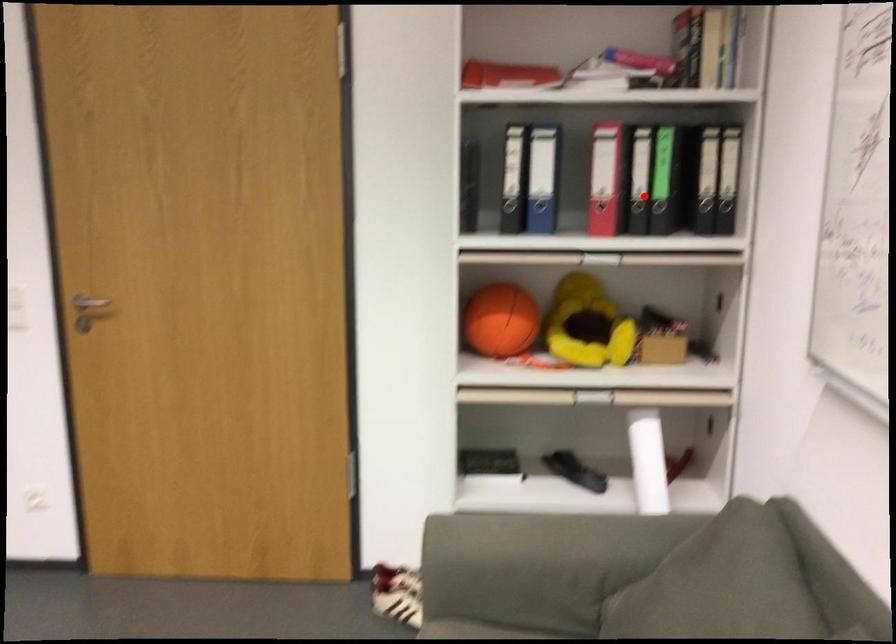
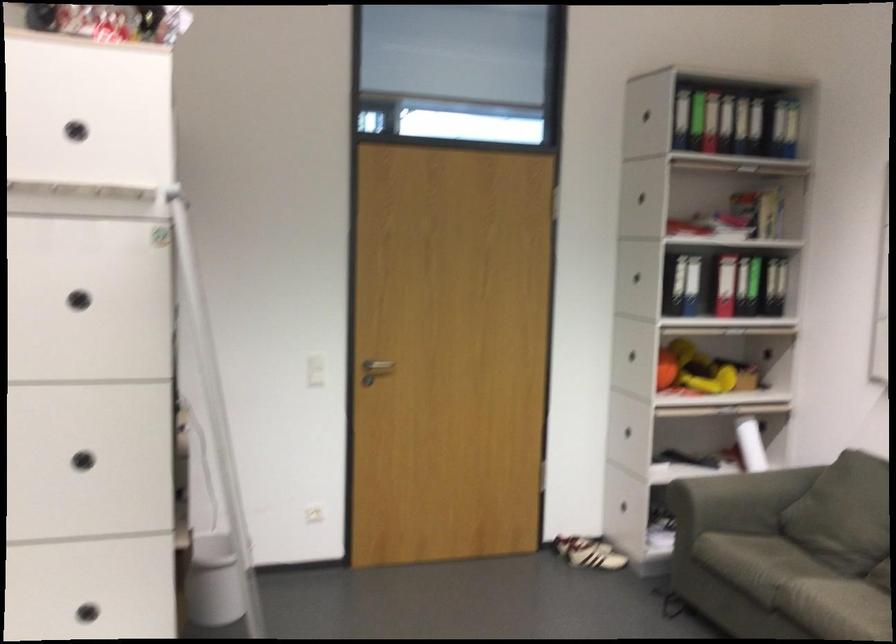
Question: I am providing you with two images of the same scene from different viewpoints. Given a red point in image1, look at the same physical point in image2. Is it:

Choices:
 (A) Closer to the viewpoint
 (B) Farther from the viewpoint

Answer: (B)